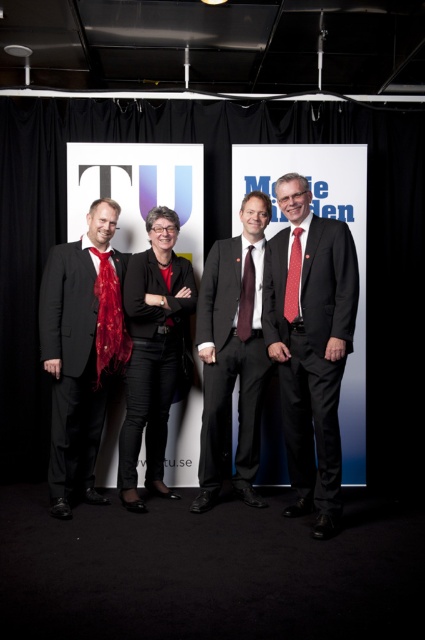
Is white paperboard at center positioned before dark gray suit at center?

That is False.

Locate an element on the screen. Image resolution: width=425 pixels, height=640 pixels. white paperboard at center is located at coordinates (212, 243).

Image resolution: width=425 pixels, height=640 pixels. What do you see at coordinates (212, 243) in the screenshot? I see `white paperboard at center` at bounding box center [212, 243].

This screenshot has height=640, width=425. In order to click on white paperboard at center in this screenshot , I will do `click(212, 243)`.

Does white paperboard at center lie in front of black matte blazer at center?

No, it is not.

Between white paperboard at center and black matte blazer at center, which one has less height?

black matte blazer at center is shorter.

What do you see at coordinates (212, 243) in the screenshot?
I see `white paperboard at center` at bounding box center [212, 243].

Where is `white paperboard at center`? This screenshot has width=425, height=640. white paperboard at center is located at coordinates (212, 243).

Between dark gray suit at center and black matte blazer at center, which one has less height?

With less height is black matte blazer at center.

Is dark gray suit at center in front of black matte blazer at center?

That is True.

Describe the element at coordinates (232, 353) in the screenshot. The image size is (425, 640). I see `dark gray suit at center` at that location.

Where is `dark gray suit at center`? This screenshot has height=640, width=425. dark gray suit at center is located at coordinates (232, 353).